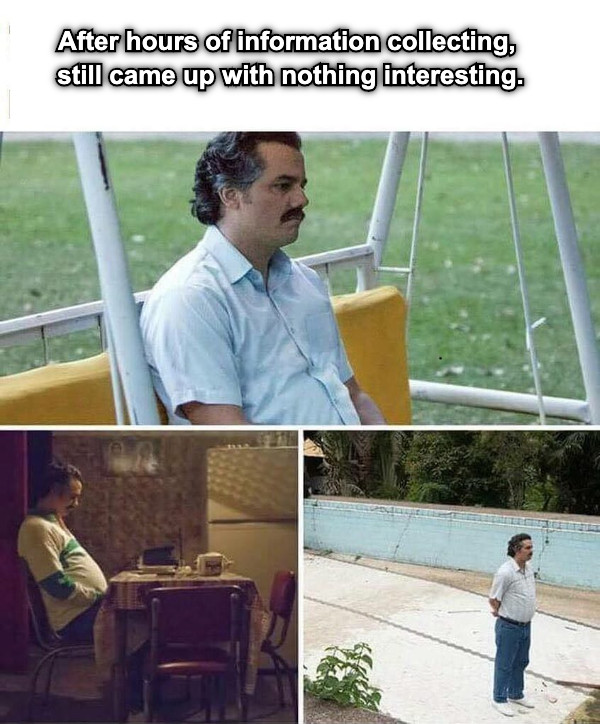
The width and height of the screenshot is (600, 724). I want to click on yellow cushion, so click(x=78, y=392), click(x=374, y=334).